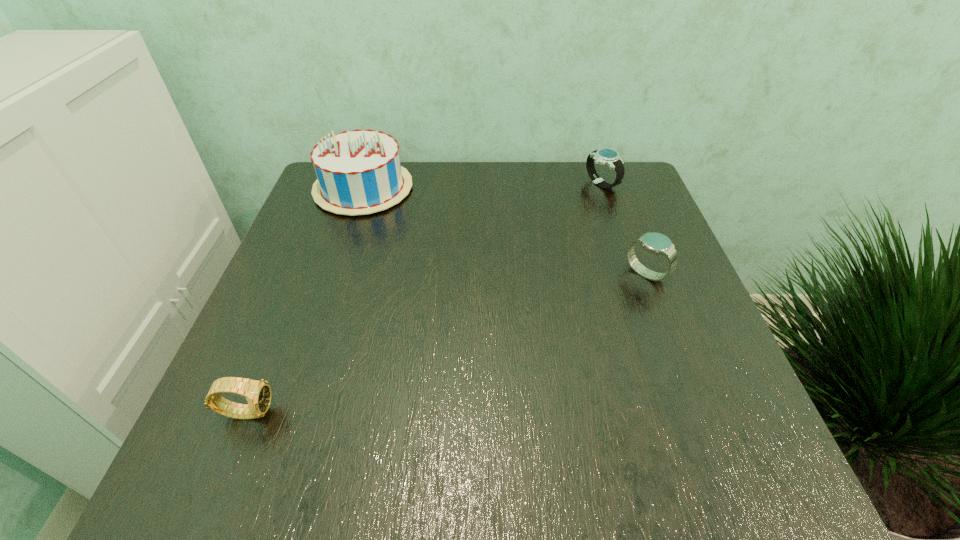
Where is `unoccupied position between the second farthest watch and the farthest watch`? unoccupied position between the second farthest watch and the farthest watch is located at coordinates (623, 229).

At what (x,y) coordinates should I click in order to perform the action: click on free space that is in between the second nearest object and the birthday cake. Please return your answer as a coordinate pair (x, y). The width and height of the screenshot is (960, 540). Looking at the image, I should click on (504, 231).

Locate an element on the screen. vacant region between the farthest watch and the nearest watch is located at coordinates (424, 298).

The width and height of the screenshot is (960, 540). I want to click on free point between the second nearest watch and the nearest watch, so click(446, 342).

The image size is (960, 540). I want to click on free point between the nearest watch and the farthest watch, so click(424, 298).

Locate an element on the screen. free space between the farthest watch and the nearest watch is located at coordinates (424, 298).

The width and height of the screenshot is (960, 540). Find the location of `free space between the nearest watch and the third farthest object`. free space between the nearest watch and the third farthest object is located at coordinates (446, 342).

The width and height of the screenshot is (960, 540). Find the location of `empty space that is in between the tallest object and the nearest watch`. empty space that is in between the tallest object and the nearest watch is located at coordinates (305, 300).

Where is `free spot between the second nearest watch and the nearest watch`? The width and height of the screenshot is (960, 540). free spot between the second nearest watch and the nearest watch is located at coordinates (446, 342).

This screenshot has width=960, height=540. I want to click on vacant space that is in between the farthest watch and the tallest object, so click(482, 186).